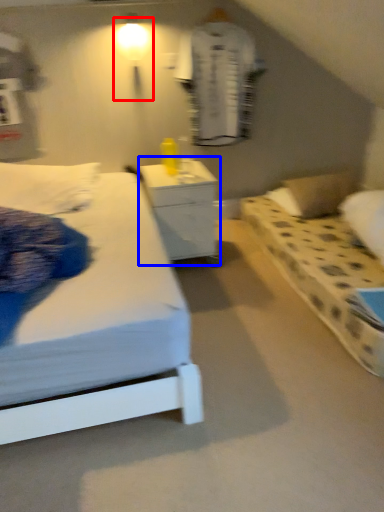
Question: Which object is closer to the camera taking this photo, light fixture (highlighted by a red box) or nightstand (highlighted by a blue box)?

Choices:
 (A) light fixture
 (B) nightstand

Answer: (B)